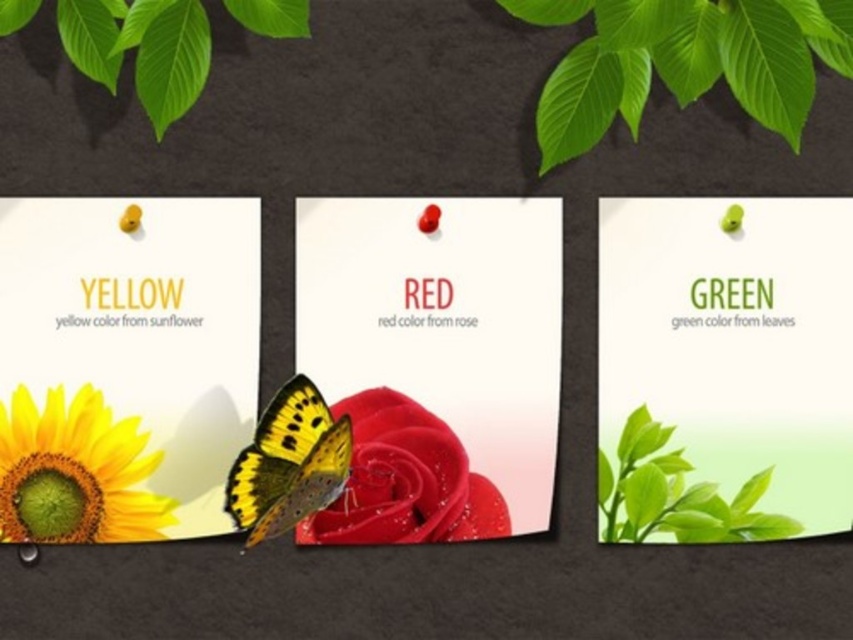
Question: Considering the relative positions of matte yellow sunflower at lower left and yellow matte butterfly at center in the image provided, where is matte yellow sunflower at lower left located with respect to yellow matte butterfly at center?

Choices:
 (A) below
 (B) above

Answer: (A)

Question: Is matte yellow sunflower at left bigger than matte plastic rose at center?

Choices:
 (A) no
 (B) yes

Answer: (B)

Question: Which point appears closest to the camera in this image?

Choices:
 (A) (405, 266)
 (B) (310, 381)

Answer: (B)

Question: Which of the following is the closest to the observer?

Choices:
 (A) matte plastic rose at center
 (B) yellow matte butterfly at center
 (C) green matte leaves at center

Answer: (B)

Question: Estimate the real-world distances between objects in this image. Which object is farther from the matte yellow sunflower at left?

Choices:
 (A) matte red rose at center
 (B) matte plastic rose at center

Answer: (A)

Question: Is matte yellow sunflower at left behind matte red rose at center?

Choices:
 (A) no
 (B) yes

Answer: (A)